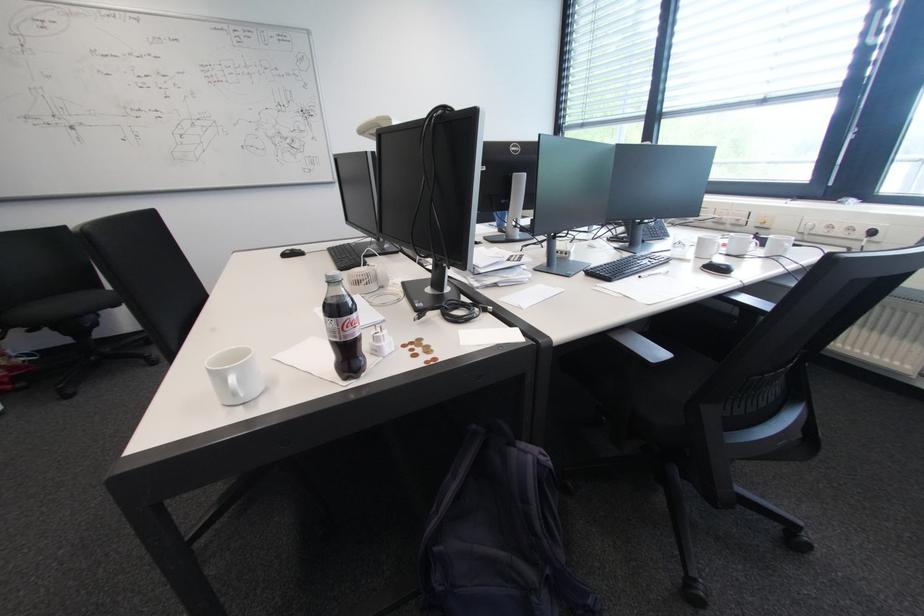
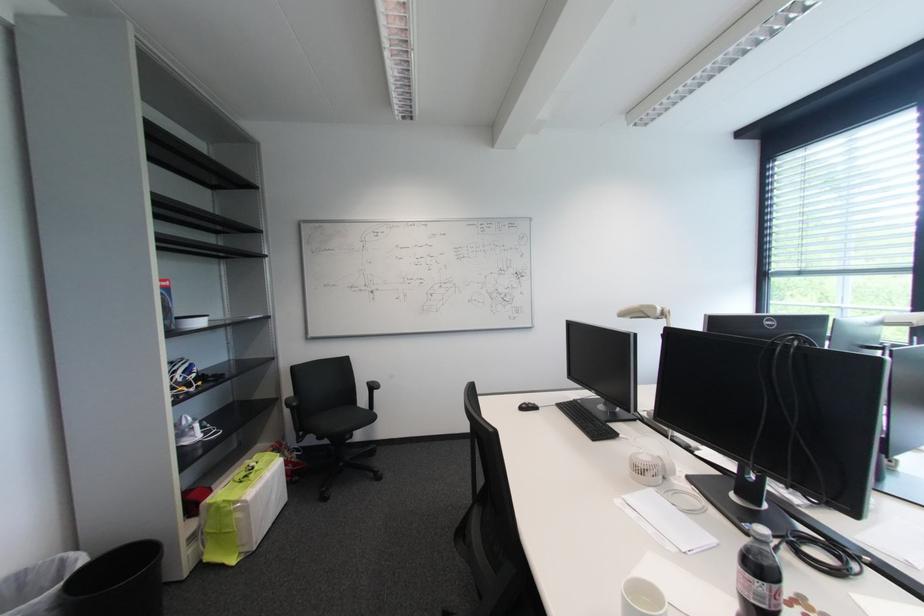
In the second image, find the point that corresponds to the point at 350,246 in the first image.

(578, 403)